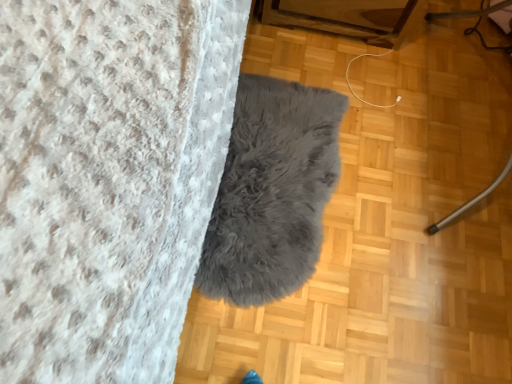
You are a GUI agent. You are given a task and a screenshot of the screen. Output one action in this format:
    pyautogui.click(x=<x>, y=<y>)
    Task: Click on the vacant area that lies to the right of gray fluffy rug at center
    
    Given the screenshot: What is the action you would take?
    pyautogui.click(x=421, y=217)